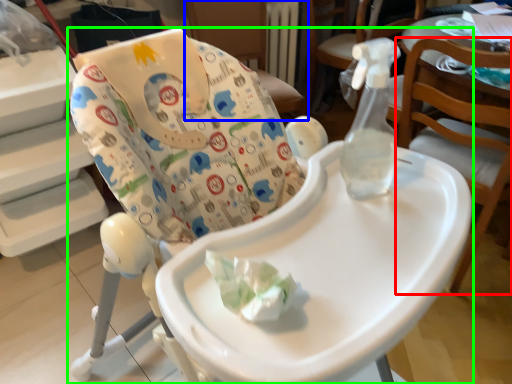
Question: Which is nearer to the chair (highlighted by a red box)? chair (highlighted by a blue box) or chair (highlighted by a green box).

Choices:
 (A) chair
 (B) chair

Answer: (B)